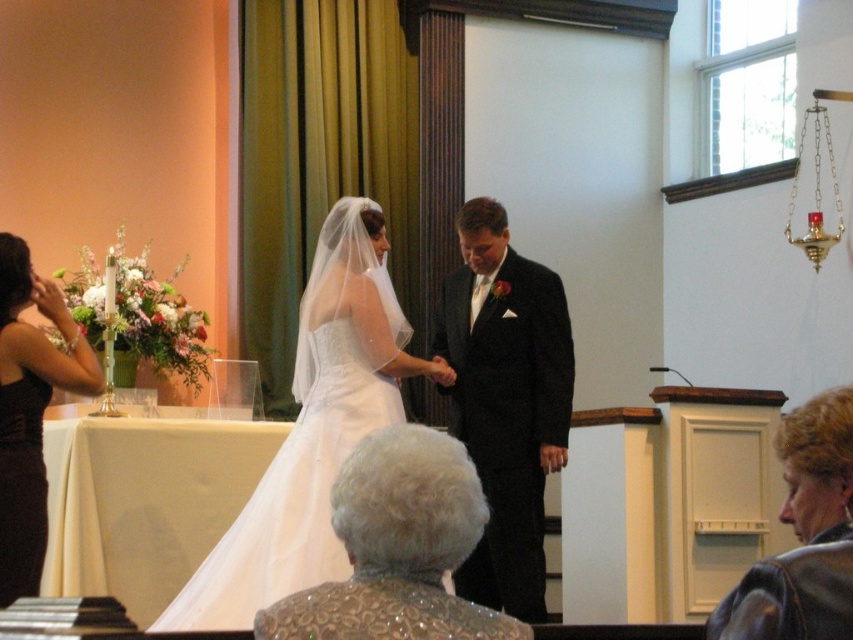
Is point (321, 536) positioned after point (28, 576)?

Yes, it is.

Does white satin dress at center come in front of black satin dress at left?

No, white satin dress at center is further to the viewer.

Identify the location of white satin dress at center. Image resolution: width=853 pixels, height=640 pixels. (312, 429).

Is black satin suit at center positioned behind black satin dress at left?

Yes, it is behind black satin dress at left.

The width and height of the screenshot is (853, 640). I want to click on black satin suit at center, so click(505, 401).

Find the location of a particular element. The height and width of the screenshot is (640, 853). black satin suit at center is located at coordinates (505, 401).

Is point (358, 216) closer to viewer compared to point (566, 378)?

Yes, point (358, 216) is in front of point (566, 378).

Can you confirm if white satin dress at center is wider than black satin suit at center?

Indeed, white satin dress at center has a greater width compared to black satin suit at center.

Who is more distant from viewer, (229, 612) or (494, 348)?

Point (494, 348)

You are a GUI agent. You are given a task and a screenshot of the screen. Output one action in this format:
    pyautogui.click(x=<x>, y=<y>)
    Task: Click on the white satin dress at center
    This screenshot has height=640, width=853.
    Given the screenshot: What is the action you would take?
    pyautogui.click(x=312, y=429)